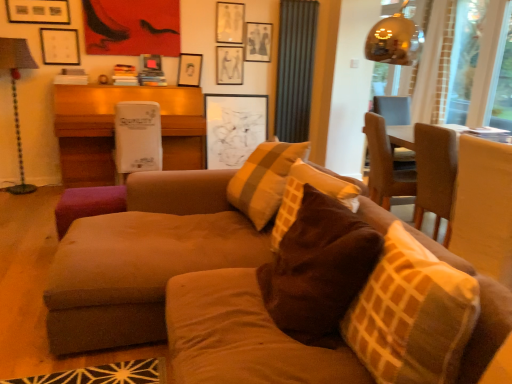
Question: Considering the relative sizes of matte black picture frame at upper center, acting as the fourth picture frame starting from the right, and transparent glass window screen at upper right, marked as the 2th window screen in a left-to-right arrangement, in the image provided, is matte black picture frame at upper center, acting as the fourth picture frame starting from the right, smaller than transparent glass window screen at upper right, marked as the 2th window screen in a left-to-right arrangement,?

Choices:
 (A) no
 (B) yes

Answer: (A)

Question: Is matte black picture frame at upper center, arranged as the second picture frame when viewed from the left, to the right of transparent glass window screen at upper right, marked as the 2th window screen in a left-to-right arrangement, from the viewer's perspective?

Choices:
 (A) yes
 (B) no

Answer: (B)

Question: Is matte black picture frame at upper center, acting as the fourth picture frame starting from the right, aimed at transparent glass window screen at upper right, marked as the 2th window screen in a left-to-right arrangement?

Choices:
 (A) no
 (B) yes

Answer: (A)

Question: Is matte black picture frame at upper center, acting as the fourth picture frame starting from the right, behind transparent glass window screen at upper right, marked as the 2th window screen in a left-to-right arrangement?

Choices:
 (A) no
 (B) yes

Answer: (B)

Question: Considering the relative positions of matte black picture frame at upper center, acting as the fourth picture frame starting from the right, and transparent glass window screen at upper right, the 1th window screen from the right, in the image provided, is matte black picture frame at upper center, acting as the fourth picture frame starting from the right, to the left of transparent glass window screen at upper right, the 1th window screen from the right, from the viewer's perspective?

Choices:
 (A) no
 (B) yes

Answer: (B)

Question: Is matte black picture frame at upper center, acting as the fourth picture frame starting from the right, closer to camera compared to transparent glass window screen at upper right, the 1th window screen from the right?

Choices:
 (A) yes
 (B) no

Answer: (B)

Question: Considering the relative sizes of metallic lampshade at left and white matte picture frame at upper left, the 5th picture frame when ordered from right to left, in the image provided, is metallic lampshade at left smaller than white matte picture frame at upper left, the 5th picture frame when ordered from right to left,?

Choices:
 (A) no
 (B) yes

Answer: (A)

Question: Can you confirm if metallic lampshade at left is positioned to the right of white matte picture frame at upper left, the 1th picture frame viewed from the left?

Choices:
 (A) yes
 (B) no

Answer: (B)

Question: From a real-world perspective, does metallic lampshade at left stand above white matte picture frame at upper left, the 1th picture frame viewed from the left?

Choices:
 (A) yes
 (B) no

Answer: (B)

Question: Is metallic lampshade at left shorter than white matte picture frame at upper left, the 5th picture frame when ordered from right to left?

Choices:
 (A) no
 (B) yes

Answer: (A)

Question: From a real-world perspective, is metallic lampshade at left physically below white matte picture frame at upper left, the 5th picture frame when ordered from right to left?

Choices:
 (A) no
 (B) yes

Answer: (B)

Question: Is the position of metallic lampshade at left less distant than that of white matte picture frame at upper left, the 1th picture frame viewed from the left?

Choices:
 (A) no
 (B) yes

Answer: (B)

Question: Considering the relative sizes of white cardboard box at center, the 1th table positioned from the left, and white matte picture frame at upper left, the 5th picture frame when ordered from right to left, in the image provided, is white cardboard box at center, the 1th table positioned from the left, smaller than white matte picture frame at upper left, the 5th picture frame when ordered from right to left,?

Choices:
 (A) no
 (B) yes

Answer: (A)